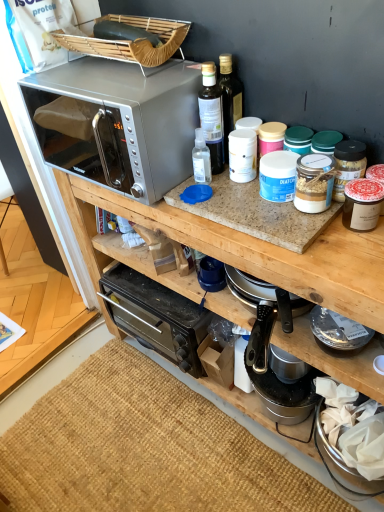
Question: From the image's perspective, is satin silver microwave at upper left under burlap mat at lower center?

Choices:
 (A) yes
 (B) no

Answer: (B)

Question: Is satin silver microwave at upper left completely or partially outside of burlap mat at lower center?

Choices:
 (A) yes
 (B) no

Answer: (A)

Question: Is satin silver microwave at upper left next to burlap mat at lower center?

Choices:
 (A) yes
 (B) no

Answer: (B)

Question: Is satin silver microwave at upper left oriented away from burlap mat at lower center?

Choices:
 (A) no
 (B) yes

Answer: (A)

Question: From a real-world perspective, is satin silver microwave at upper left on burlap mat at lower center?

Choices:
 (A) yes
 (B) no

Answer: (A)

Question: Is metallic silver coffee maker at center, which is the first appliance in back-to-front order, taller or shorter than matte glass jar at right, positioned as the 2th appliance in bottom-to-top order?

Choices:
 (A) short
 (B) tall

Answer: (B)

Question: Is point (306, 409) positioned closer to the camera than point (365, 179)?

Choices:
 (A) closer
 (B) farther

Answer: (B)

Question: From the image's perspective, is metallic silver coffee maker at center, which is the first appliance in back-to-front order, positioned above or below matte glass jar at right, positioned as the 2th appliance in bottom-to-top order?

Choices:
 (A) below
 (B) above

Answer: (A)

Question: Based on their sizes in the image, would you say metallic silver coffee maker at center, which is the 2th appliance from front to back, is bigger or smaller than matte glass jar at right, the second appliance from the back?

Choices:
 (A) small
 (B) big

Answer: (B)

Question: Does point (206, 77) appear closer or farther from the camera than point (355, 185)?

Choices:
 (A) farther
 (B) closer

Answer: (A)

Question: Is translucent plastic spray bottle at upper center, placed as the 2th bottle when sorted from right to left, bigger or smaller than matte glass jar at right, the second appliance from the back?

Choices:
 (A) big
 (B) small

Answer: (A)

Question: Considering the positions of translucent plastic spray bottle at upper center, the 1th bottle from the left, and matte glass jar at right, the first appliance positioned from the front, in the image, is translucent plastic spray bottle at upper center, the 1th bottle from the left, wider or thinner than matte glass jar at right, the first appliance positioned from the front,?

Choices:
 (A) wide
 (B) thin

Answer: (B)

Question: From a real-world perspective, relative to matte glass jar at right, the second appliance from the back, is translucent plastic spray bottle at upper center, the 1th bottle from the left, vertically above or below?

Choices:
 (A) above
 (B) below

Answer: (A)

Question: Is burlap mat at lower center to the left or to the right of metallic silver coffee maker at center, which is the first appliance in back-to-front order, in the image?

Choices:
 (A) left
 (B) right

Answer: (A)

Question: In the image, is burlap mat at lower center positioned in front of or behind metallic silver coffee maker at center, which ranks as the 2th appliance in top-to-bottom order?

Choices:
 (A) front
 (B) behind

Answer: (A)